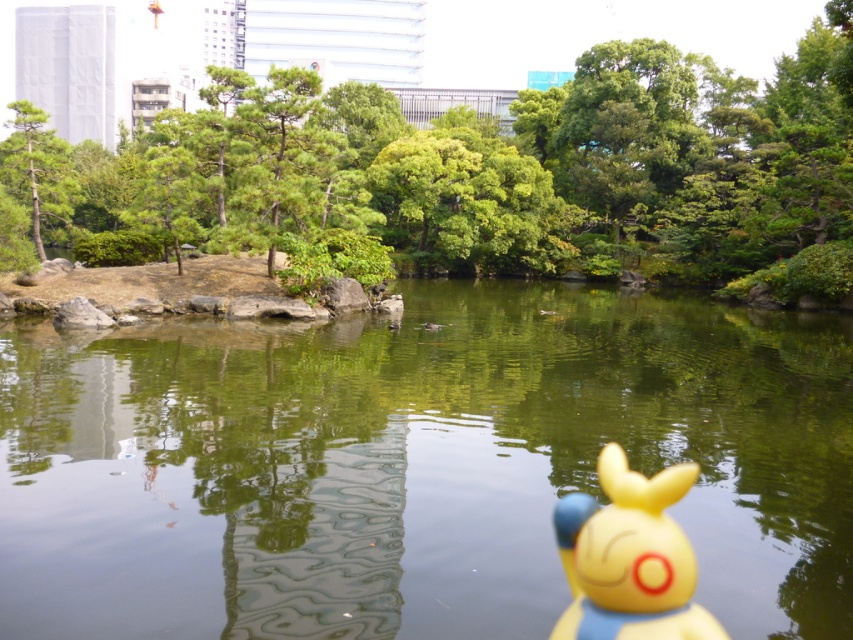
Question: Can you confirm if green reflective water at center is positioned above yellow rubber duck at lower right?

Choices:
 (A) yes
 (B) no

Answer: (A)

Question: Can you confirm if green reflective water at center is positioned to the right of green leafy tree at upper center?

Choices:
 (A) no
 (B) yes

Answer: (B)

Question: Which object is the farthest from the green matte tree at upper left?

Choices:
 (A) green leafy tree at upper center
 (B) yellow rubber duck at lower right
 (C) green reflective water at center

Answer: (A)

Question: Among these objects, which one is farthest from the camera?

Choices:
 (A) yellow rubber duck at lower right
 (B) green leafy tree at upper center
 (C) green reflective water at center

Answer: (B)

Question: Which object appears closest to the camera in this image?

Choices:
 (A) yellow rubber duck at lower right
 (B) green matte tree at upper left
 (C) green leafy tree at upper center

Answer: (A)

Question: Does green leafy tree at upper center appear on the left side of yellow rubber duck at lower right?

Choices:
 (A) yes
 (B) no

Answer: (A)